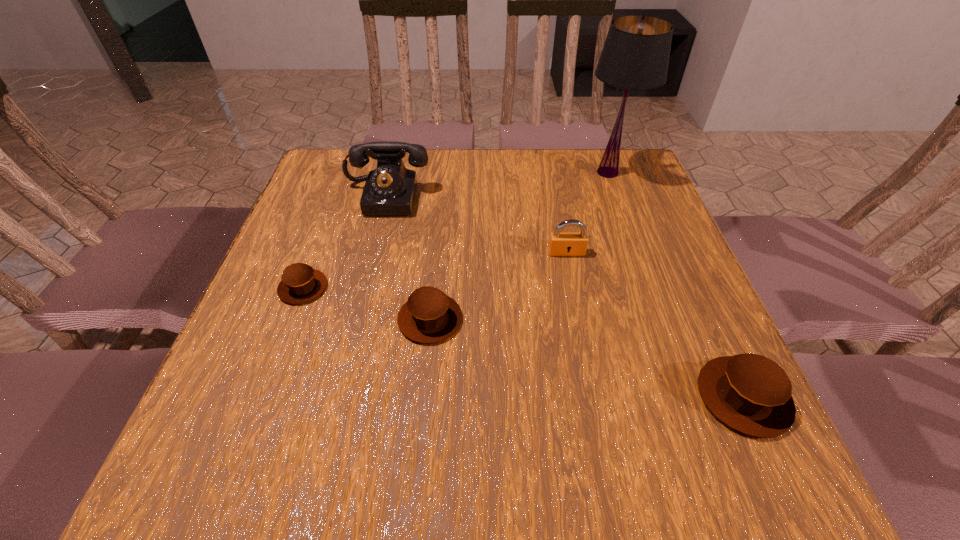
This screenshot has width=960, height=540. What are the coordinates of `vacant area at the far left corner of the desktop` in the screenshot? It's located at (335, 152).

The width and height of the screenshot is (960, 540). I want to click on free point between the padlock and the second shortest object, so tap(498, 286).

This screenshot has width=960, height=540. I want to click on free space between the second shortest muffin and the tallest object, so click(x=518, y=246).

Identify the location of free space between the nearest object and the second shortest muffin. (587, 358).

Where is `free spot between the second shortest muffin and the rightmost muffin`? This screenshot has width=960, height=540. free spot between the second shortest muffin and the rightmost muffin is located at coordinates (587, 358).

This screenshot has height=540, width=960. I want to click on vacant point located between the second shortest muffin and the tallest object, so click(x=518, y=246).

At what (x,y) coordinates should I click in order to perform the action: click on free space between the shortest object and the second muffin from right to left. Please return your answer as a coordinate pair (x, y). Looking at the image, I should click on (367, 303).

At what (x,y) coordinates should I click in order to perform the action: click on vacant area between the tallest muffin and the fourth object from left to right. Please return your answer as a coordinate pair (x, y). The image size is (960, 540). Looking at the image, I should click on (655, 325).

You are a GUI agent. You are given a task and a screenshot of the screen. Output one action in this format:
    pyautogui.click(x=<x>, y=<y>)
    Task: Click on the free point between the nearest object and the shortest muffin
    The width and height of the screenshot is (960, 540).
    Given the screenshot: What is the action you would take?
    pyautogui.click(x=523, y=342)

Where is `empty space that is in between the telephone and the padlock`? The width and height of the screenshot is (960, 540). empty space that is in between the telephone and the padlock is located at coordinates (477, 225).